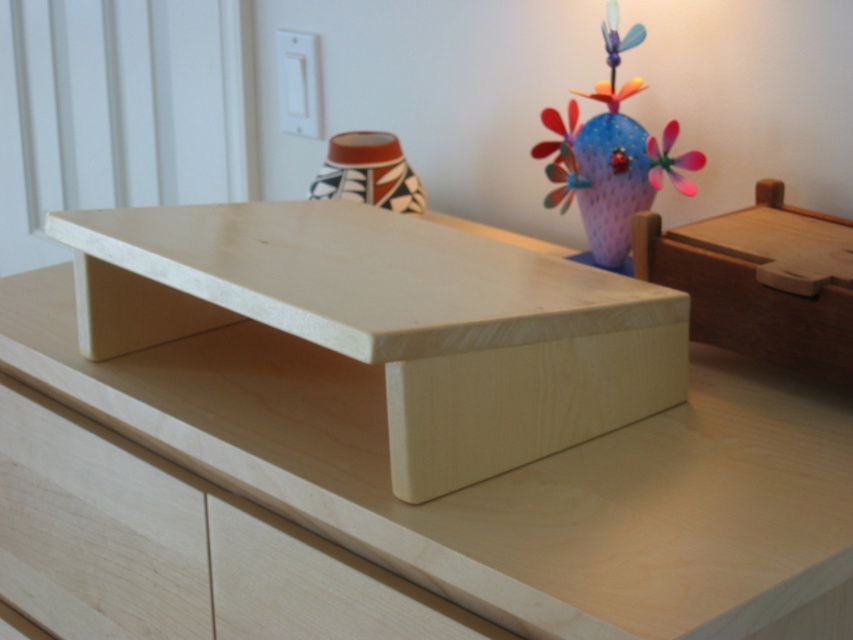
Can you confirm if natural wood drawer at lower left is positioned to the right of metallic pink flower at upper right?

Incorrect, natural wood drawer at lower left is not on the right side of metallic pink flower at upper right.

Between point (143, 561) and point (550, 118), which one is positioned in front?

Positioned in front is point (143, 561).

This screenshot has width=853, height=640. What are the coordinates of `natural wood drawer at lower left` in the screenshot? It's located at tap(96, 529).

Between point (119, 499) and point (675, 163), which one is positioned behind?

The point (675, 163) is more distant.

Does point (61, 614) lie behind point (689, 164)?

No, it is in front of (689, 164).

I want to click on natural wood drawer at lower left, so click(96, 529).

Who is more distant from viewer, (320, 193) or (569, 193)?

Positioned behind is point (320, 193).

Measure the distance between matte geometric vase at center and camera.

matte geometric vase at center and camera are 4.53 feet apart from each other.

Is point (393, 152) positioned before point (553, 125)?

That is False.

You are a GUI agent. You are given a task and a screenshot of the screen. Output one action in this format:
    pyautogui.click(x=<x>, y=<y>)
    Task: Click on the matte geometric vase at center
    
    Given the screenshot: What is the action you would take?
    pyautogui.click(x=368, y=172)